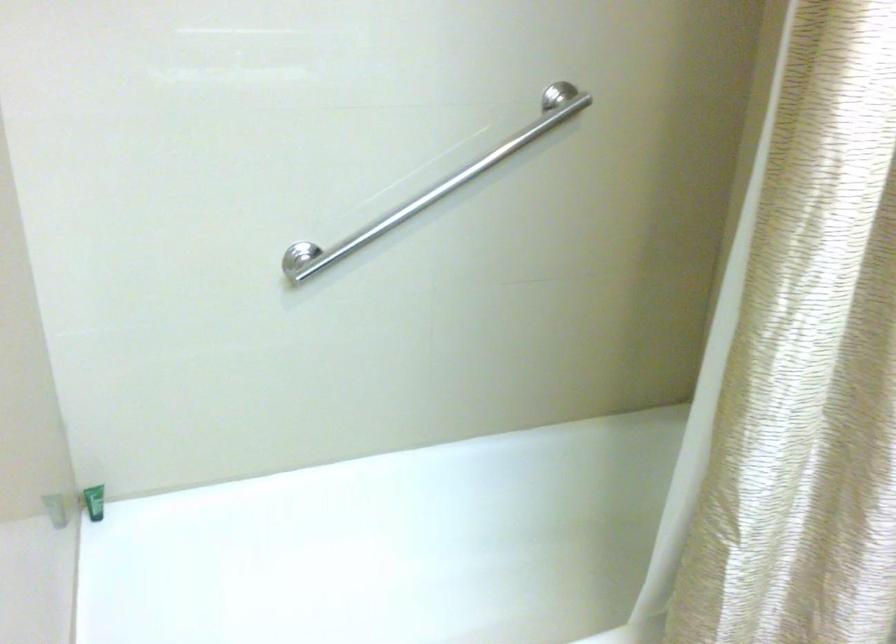
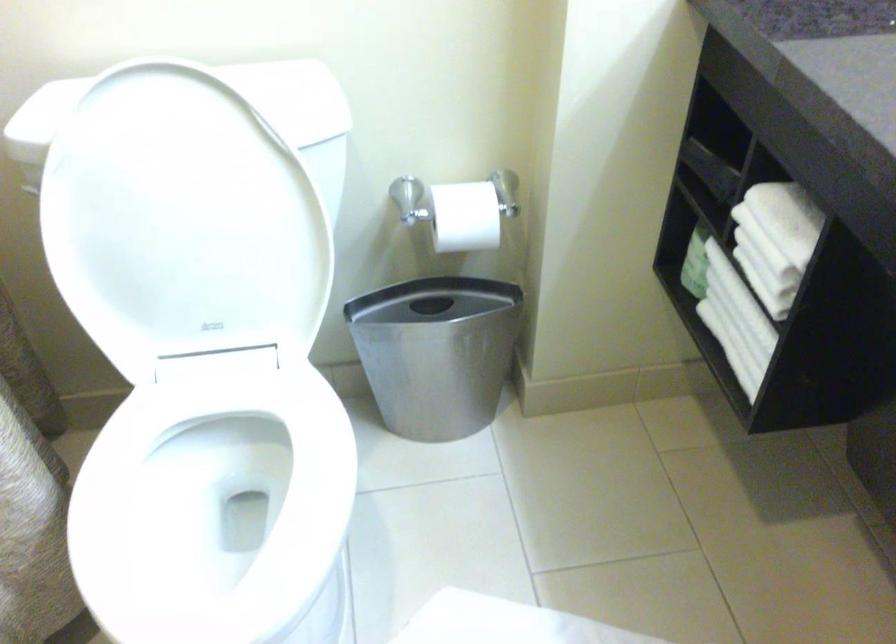
How did the camera likely rotate?

The rotation direction of the camera is right-down.